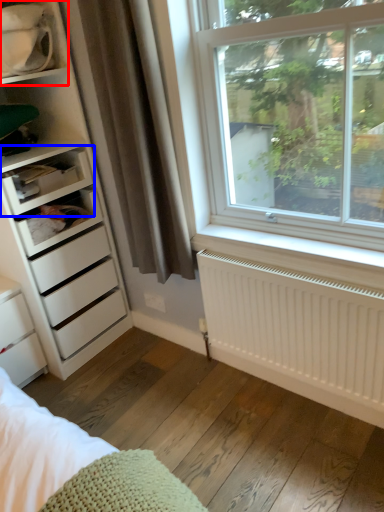
Question: Which object is further to the camera taking this photo, shelf (highlighted by a red box) or shelf (highlighted by a blue box)?

Choices:
 (A) shelf
 (B) shelf

Answer: (B)